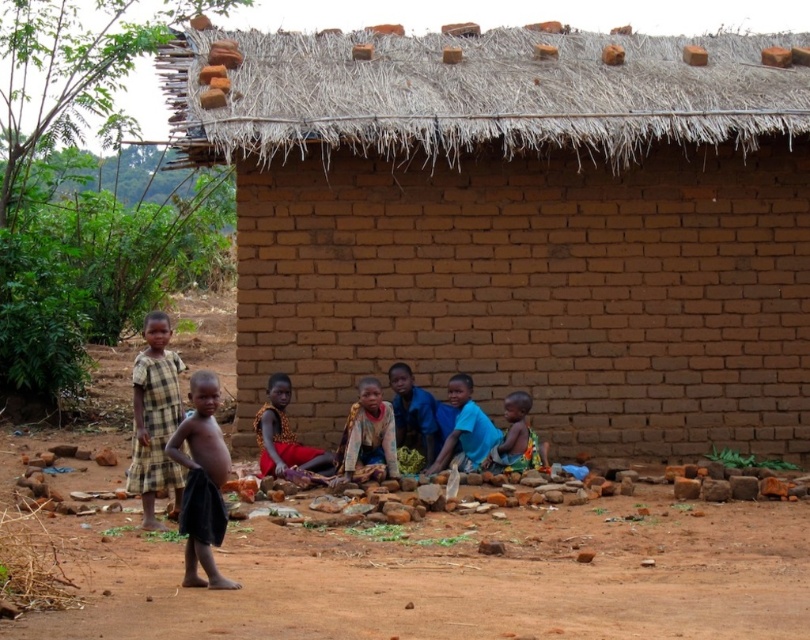
Looking at this image, does brown mud hut at center appear over thatched straw roof at upper center?

No, brown mud hut at center is not above thatched straw roof at upper center.

Does point (523, 99) lie behind point (770, 120)?

Yes, it is behind point (770, 120).

You are a GUI agent. You are given a task and a screenshot of the screen. Output one action in this format:
    pyautogui.click(x=<x>, y=<y>)
    Task: Click on the brown mud hut at center
    The width and height of the screenshot is (810, 640).
    Given the screenshot: What is the action you would take?
    pyautogui.click(x=519, y=225)

Who is more forward, [348,54] or [386,472]?

Positioned in front is point [386,472].

Which is behind, point (583, 108) or point (360, 429)?

The point (583, 108) is behind.

This screenshot has height=640, width=810. What do you see at coordinates (476, 92) in the screenshot?
I see `thatched straw roof at upper center` at bounding box center [476, 92].

At what (x,y) coordinates should I click in order to perform the action: click on thatched straw roof at upper center. Please return your answer as a coordinate pair (x, y). Image resolution: width=810 pixels, height=640 pixels. Looking at the image, I should click on (476, 92).

Between point (406, 305) and point (182, 522), which one is positioned in front?

Point (182, 522) is more forward.

Which is behind, point (808, 394) or point (222, 458)?

Positioned behind is point (808, 394).

Does point (454, 308) lie in front of point (222, 529)?

No, (454, 308) is behind (222, 529).

At what (x,y) coordinates should I click in order to perform the action: click on brown mud hut at center. Please return your answer as a coordinate pair (x, y). The width and height of the screenshot is (810, 640). Looking at the image, I should click on (519, 225).